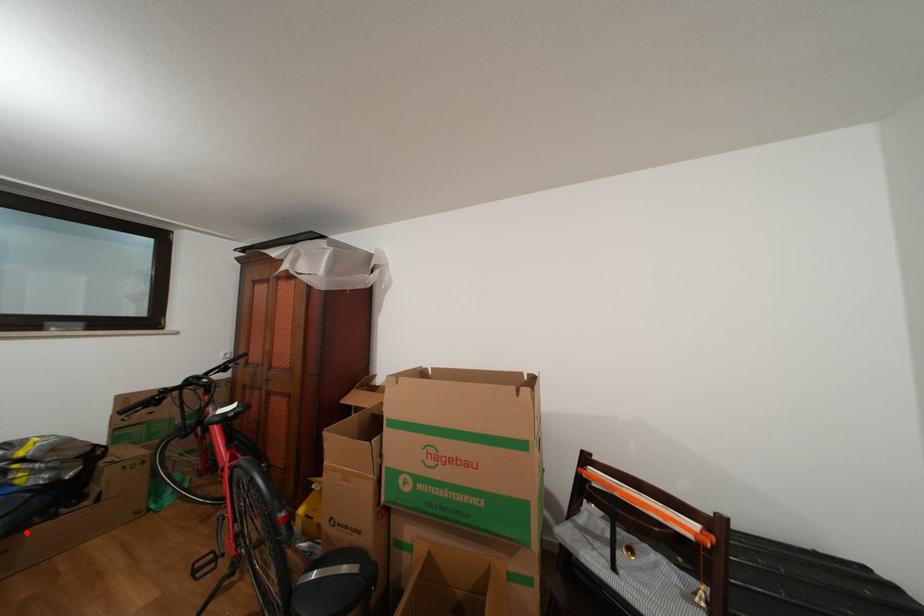
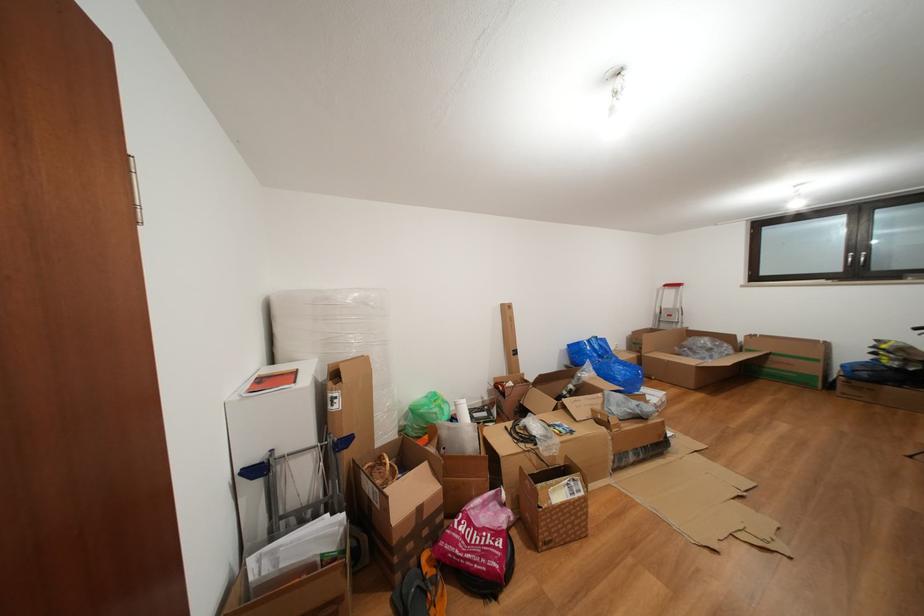
Question: I am providing you with two images of the same scene from different viewpoints. A red point is shown in image1. For the corresponding object point in image2, is it positioned nearer or farther from the camera?

Choices:
 (A) Nearer
 (B) Farther

Answer: (B)